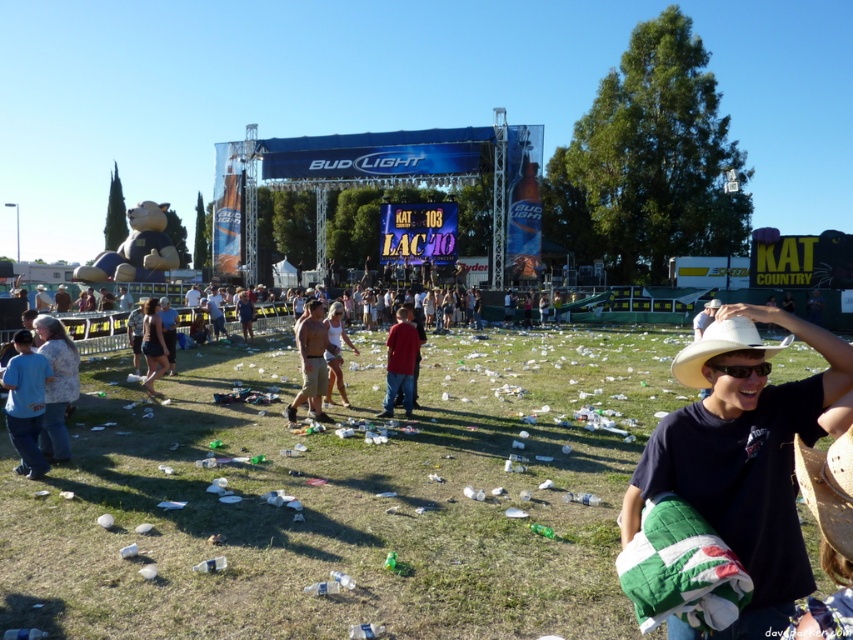
Is light brown leather jacket at center bigger than white straw hat at center?

No.

The width and height of the screenshot is (853, 640). What do you see at coordinates (215, 310) in the screenshot? I see `light brown leather jacket at center` at bounding box center [215, 310].

Which is behind, point (210, 307) or point (717, 305)?

The point (210, 307) is behind.

I want to click on light brown leather jacket at center, so click(215, 310).

Which of these two, matte black tank top at center or light brown leather jacket at center, stands shorter?

matte black tank top at center is shorter.

Locate an element on the screen. matte black tank top at center is located at coordinates (154, 346).

In the scene shown: Between tan cotton shorts at center and black plastic goggles at center, which one is positioned lower?

Positioned lower is tan cotton shorts at center.

Between point (323, 348) and point (712, 360), which one is positioned in front?

Point (712, 360) is more forward.

Where is `tan cotton shorts at center`? The width and height of the screenshot is (853, 640). tan cotton shorts at center is located at coordinates (311, 362).